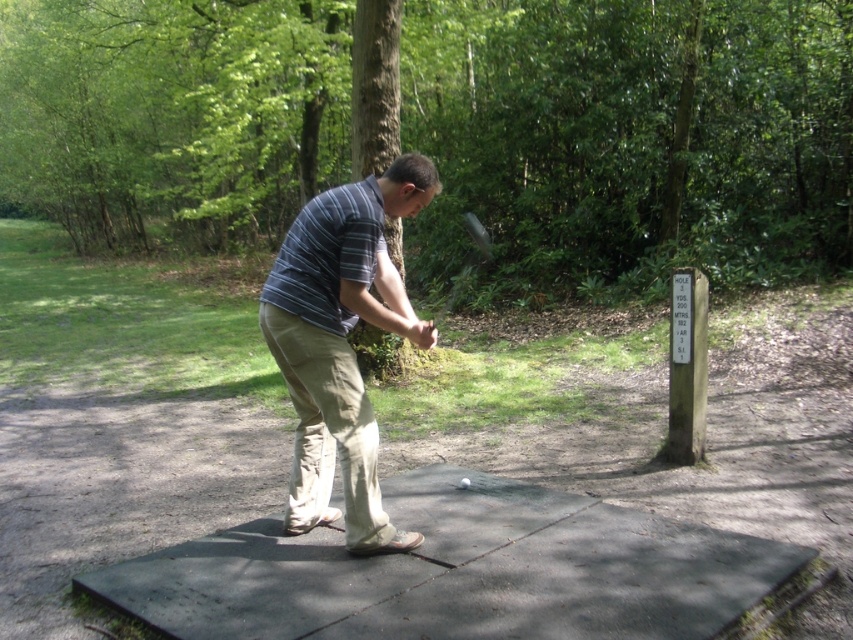
Question: Which point is farther from the camera taking this photo?

Choices:
 (A) (489, 244)
 (B) (427, 593)
 (C) (292, 227)

Answer: (A)

Question: Can you confirm if green rubber mat at center is positioned above striped cotton shirt at center?

Choices:
 (A) no
 (B) yes

Answer: (A)

Question: Is green rubber mat at center to the left of striped cotton shirt at center from the viewer's perspective?

Choices:
 (A) yes
 (B) no

Answer: (B)

Question: Among these points, which one is farthest from the camera?

Choices:
 (A) click(460, 269)
 (B) click(479, 580)

Answer: (A)

Question: Which point appears farthest from the camera in this image?

Choices:
 (A) (434, 324)
 (B) (399, 156)

Answer: (A)

Question: Can you confirm if green rubber mat at center is positioned to the right of shiny black golf club at center?

Choices:
 (A) yes
 (B) no

Answer: (B)